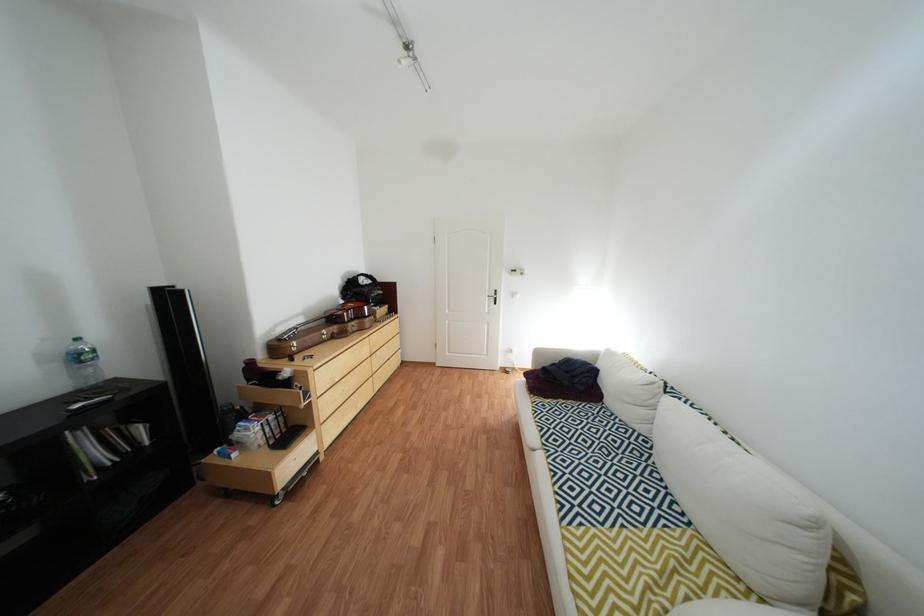
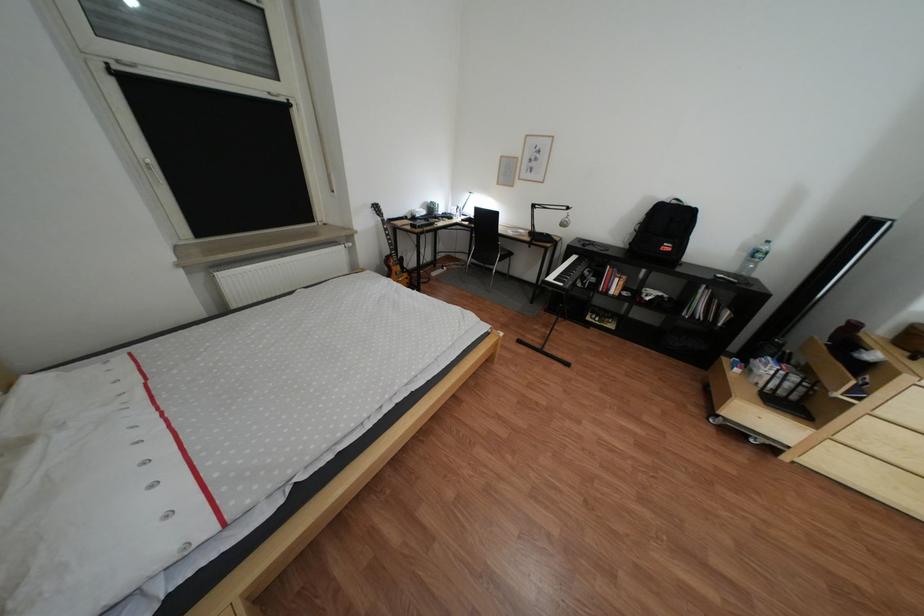
The point at (74, 366) is marked in the first image. Where is the corresponding point in the second image?

(760, 256)